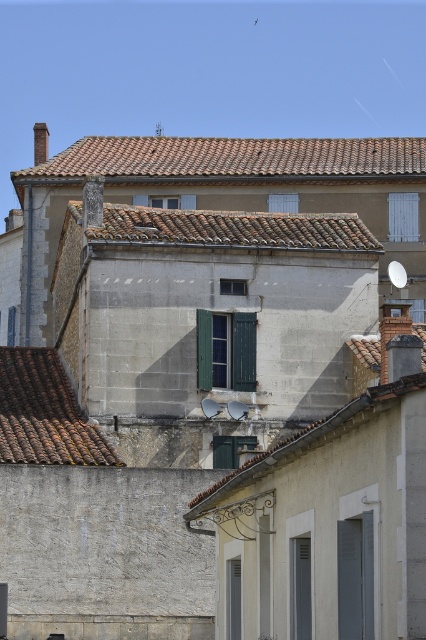
Does brown tile roof at upper center appear on the left side of brown tile roof at center?

Correct, you'll find brown tile roof at upper center to the left of brown tile roof at center.

Describe the element at coordinates (233, 157) in the screenshot. The image size is (426, 640). I see `brown tile roof at upper center` at that location.

This screenshot has width=426, height=640. I want to click on brown tile roof at upper center, so click(x=233, y=157).

The width and height of the screenshot is (426, 640). What do you see at coordinates (233, 157) in the screenshot? I see `brown tile roof at upper center` at bounding box center [233, 157].

Can you confirm if brown tile roof at upper center is taller than green painted wood shutter at upper center?

Indeed, brown tile roof at upper center has a greater height compared to green painted wood shutter at upper center.

What do you see at coordinates (233, 157) in the screenshot? The width and height of the screenshot is (426, 640). I see `brown tile roof at upper center` at bounding box center [233, 157].

Find the location of a particular element. Image resolution: width=426 pixels, height=640 pixels. brown tile roof at upper center is located at coordinates coord(233,157).

Is brown tile roof at lower left below green matte shutter at center?

No, brown tile roof at lower left is not below green matte shutter at center.

Which is behind, point (28, 381) or point (344, 637)?

Point (28, 381)

Locate an element on the screen. The width and height of the screenshot is (426, 640). brown tile roof at lower left is located at coordinates (45, 413).